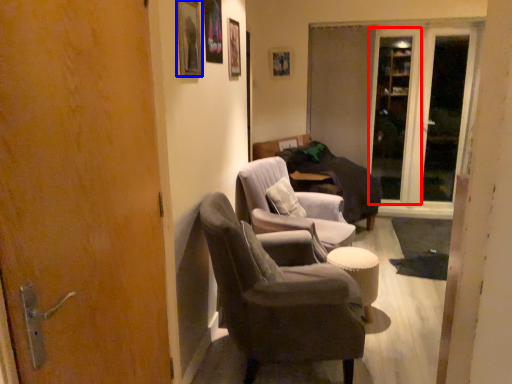
Question: Which object is closer to the camera taking this photo, screen door (highlighted by a red box) or picture frame (highlighted by a blue box)?

Choices:
 (A) screen door
 (B) picture frame

Answer: (B)